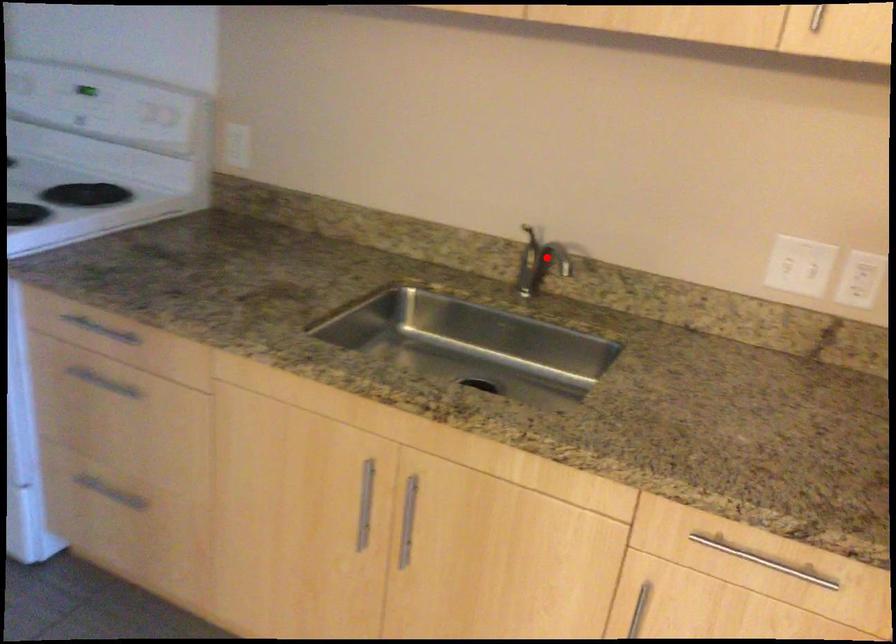
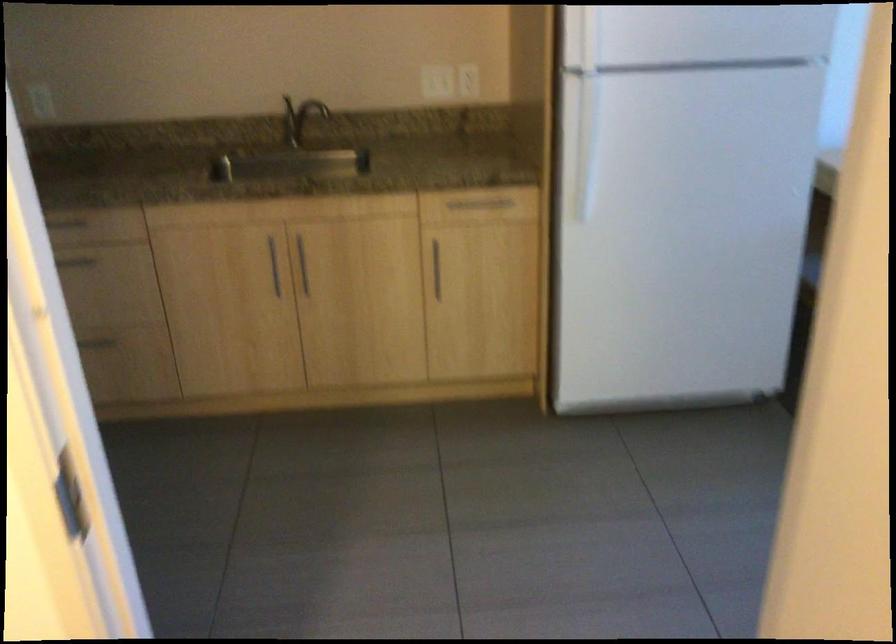
Question: I am providing you with two images of the same scene from different viewpoints. A red point is shown in image1. For the corresponding object point in image2, is it positioned nearer or farther from the camera?

Choices:
 (A) Nearer
 (B) Farther

Answer: (B)